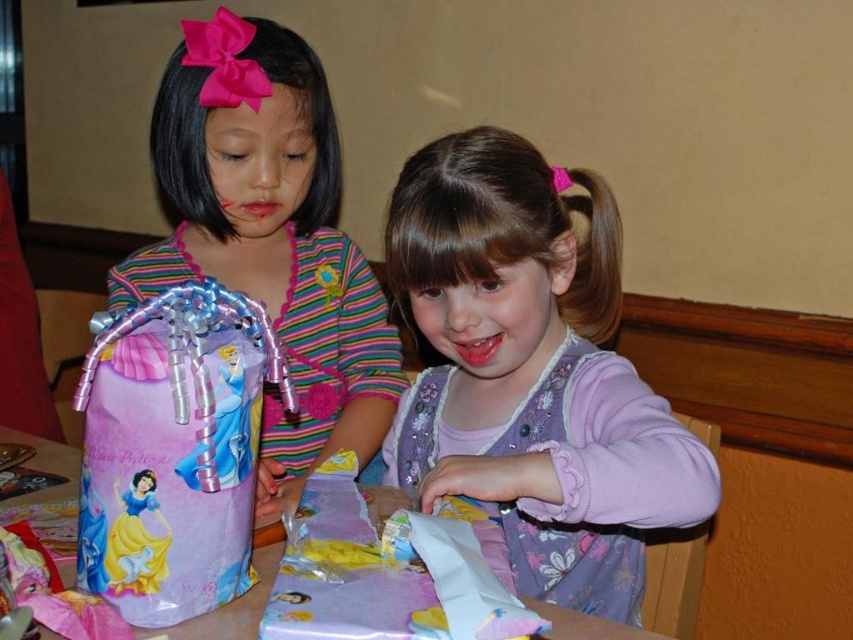
Between matte pink gift bag at left and matte plastic bag at left, which one is positioned lower?

Positioned lower is matte plastic bag at left.

Who is positioned more to the right, matte pink gift bag at left or matte plastic bag at left?

Positioned to the right is matte plastic bag at left.

This screenshot has height=640, width=853. In order to click on matte pink gift bag at left in this screenshot , I will do `click(270, 236)`.

Where is `matte pink gift bag at left`? This screenshot has width=853, height=640. matte pink gift bag at left is located at coordinates (270, 236).

In the scene shown: Measure the distance from purple floral dress at center to pink glossy paper at lower center.

They are 8.08 inches apart.

Does point (508, 490) come closer to viewer compared to point (361, 545)?

No, it is behind (361, 545).

Where is `purple floral dress at center`? This screenshot has height=640, width=853. purple floral dress at center is located at coordinates (532, 372).

Who is positioned more to the right, matte pink gift bag at left or pink glossy paper at lower center?

pink glossy paper at lower center is more to the right.

Which is behind, point (332, 420) or point (302, 637)?

The point (332, 420) is more distant.

This screenshot has height=640, width=853. I want to click on matte pink gift bag at left, so click(x=270, y=236).